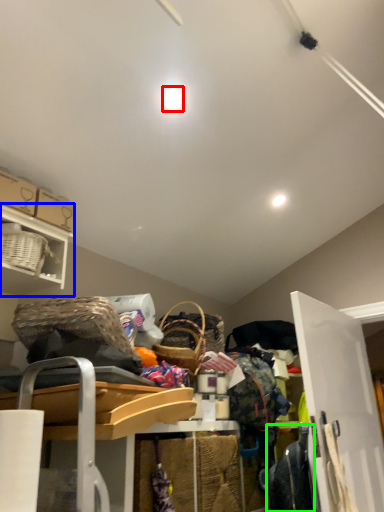
Question: Considering the real-world distances, which object is closest to light (highlighted by a red box)? shelf (highlighted by a blue box) or clothing (highlighted by a green box).

Choices:
 (A) shelf
 (B) clothing

Answer: (A)